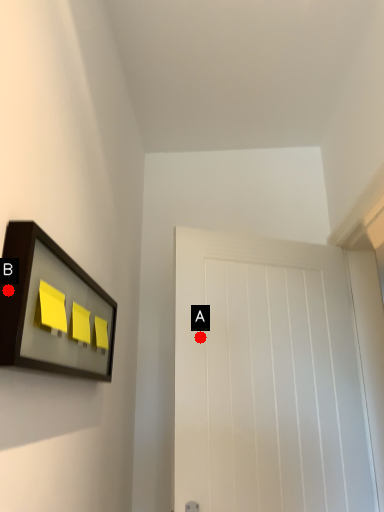
Question: Two points are circled on the image, labeled by A and B beside each circle. Which of the following is the closest to the observer?

Choices:
 (A) A is closer
 (B) B is closer

Answer: (B)